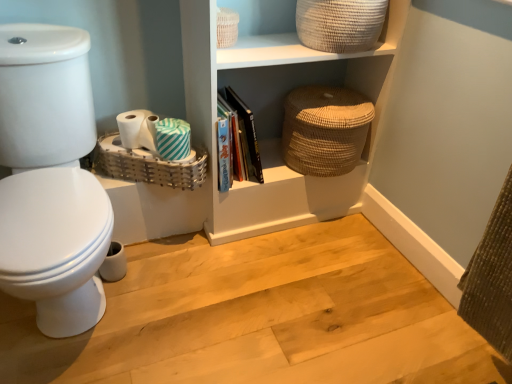
Question: From a real-world perspective, is white matte toilet paper at lower left, which appears as the 3th toilet paper when viewed from the right, below beige woven basket at upper center, which is the 2th basket from left to right?

Choices:
 (A) yes
 (B) no

Answer: (A)

Question: Is white matte toilet paper at lower left, which appears as the 3th toilet paper when viewed from the right, at the left side of beige woven basket at upper center, the 2th basket from the right?

Choices:
 (A) no
 (B) yes

Answer: (B)

Question: Is white matte toilet paper at lower left, which appears as the 3th toilet paper when viewed from the right, facing towards beige woven basket at upper center, the 2th basket from the right?

Choices:
 (A) no
 (B) yes

Answer: (A)

Question: Can you confirm if white matte toilet paper at lower left, which appears as the 3th toilet paper when viewed from the right, is bigger than beige woven basket at upper center, which is the 2th basket from left to right?

Choices:
 (A) no
 (B) yes

Answer: (A)

Question: Can you confirm if white matte toilet paper at lower left, which ranks as the 1th toilet paper in left-to-right order, is positioned to the right of beige woven basket at upper center, which is the 2th basket from left to right?

Choices:
 (A) yes
 (B) no

Answer: (B)

Question: Is beige woven basket at upper center, the 2th basket from the right, to the left or to the right of white matte toilet paper at lower left, which appears as the 3th toilet paper when viewed from the right, in the image?

Choices:
 (A) right
 (B) left

Answer: (A)

Question: Is point (330, 36) closer or farther from the camera than point (154, 134)?

Choices:
 (A) farther
 (B) closer

Answer: (B)

Question: Is beige woven basket at upper center, which is the 2th basket from left to right, inside the boundaries of white matte toilet paper at lower left, which appears as the 3th toilet paper when viewed from the right, or outside?

Choices:
 (A) inside
 (B) outside

Answer: (B)

Question: Considering their positions, is beige woven basket at upper center, which is the 2th basket from left to right, located in front of or behind white matte toilet paper at lower left, which appears as the 3th toilet paper when viewed from the right?

Choices:
 (A) behind
 (B) front

Answer: (B)

Question: Based on their sizes in the image, would you say woven wicker basket at lower left, the first basket viewed from the left, is bigger or smaller than beige woven basket at upper center, the 2th basket from the right?

Choices:
 (A) big
 (B) small

Answer: (B)

Question: From a real-world perspective, is woven wicker basket at lower left, which ranks as the third basket in right-to-left order, positioned above or below beige woven basket at upper center, which is the 2th basket from left to right?

Choices:
 (A) below
 (B) above

Answer: (A)

Question: Relative to beige woven basket at upper center, which is the 2th basket from left to right, is woven wicker basket at lower left, which ranks as the third basket in right-to-left order, in front or behind?

Choices:
 (A) front
 (B) behind

Answer: (B)

Question: Considering the positions of point (186, 180) and point (318, 46), is point (186, 180) closer or farther from the camera than point (318, 46)?

Choices:
 (A) closer
 (B) farther

Answer: (B)

Question: Is wooden floor at lower left wider or thinner than teal striped toilet paper at center, which is counted as the third toilet paper, starting from the left?

Choices:
 (A) thin
 (B) wide

Answer: (B)

Question: In terms of height, does wooden floor at lower left look taller or shorter compared to teal striped toilet paper at center, which is counted as the third toilet paper, starting from the left?

Choices:
 (A) tall
 (B) short

Answer: (B)